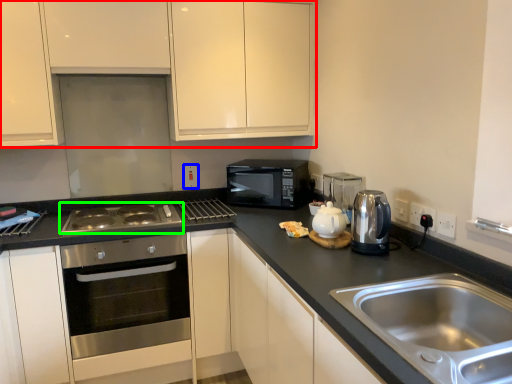
Question: Considering the real-world distances, which object is closest to cabinetry (highlighted by a red box)? electric outlet (highlighted by a blue box) or gas stove (highlighted by a green box).

Choices:
 (A) electric outlet
 (B) gas stove

Answer: (B)